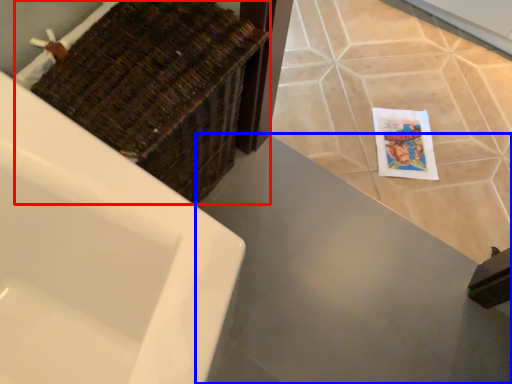
Question: Which object is closer to the camera taking this photo, basket (highlighted by a red box) or counter top (highlighted by a blue box)?

Choices:
 (A) basket
 (B) counter top

Answer: (A)